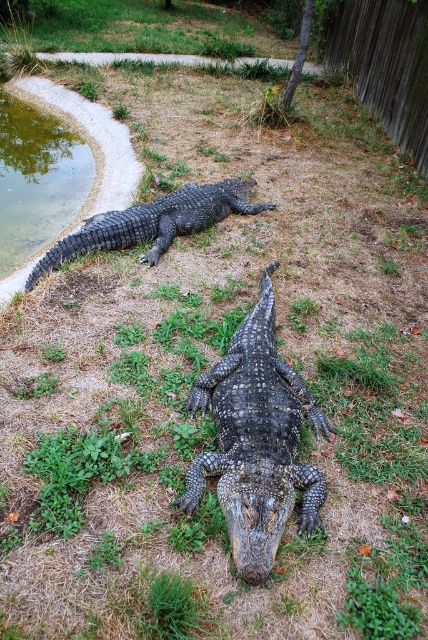
Question: Which point is farther to the camera?

Choices:
 (A) greenish water at bottom left
 (B) dark scaly crocodile at center
 (C) shiny black crocodile at center

Answer: (A)

Question: Which object appears closest to the camera in this image?

Choices:
 (A) shiny black crocodile at center
 (B) greenish water at bottom left
 (C) dark scaly crocodile at center

Answer: (A)

Question: Can you confirm if greenish water at bottom left is positioned below dark scaly crocodile at center?

Choices:
 (A) yes
 (B) no

Answer: (B)

Question: Which point is closer to the camera?

Choices:
 (A) (143, 205)
 (B) (89, 164)
 (C) (273, 323)

Answer: (C)

Question: Is shiny black crocodile at center above greenish water at bottom left?

Choices:
 (A) yes
 (B) no

Answer: (B)

Question: Does greenish water at bottom left appear under dark scaly crocodile at center?

Choices:
 (A) yes
 (B) no

Answer: (B)